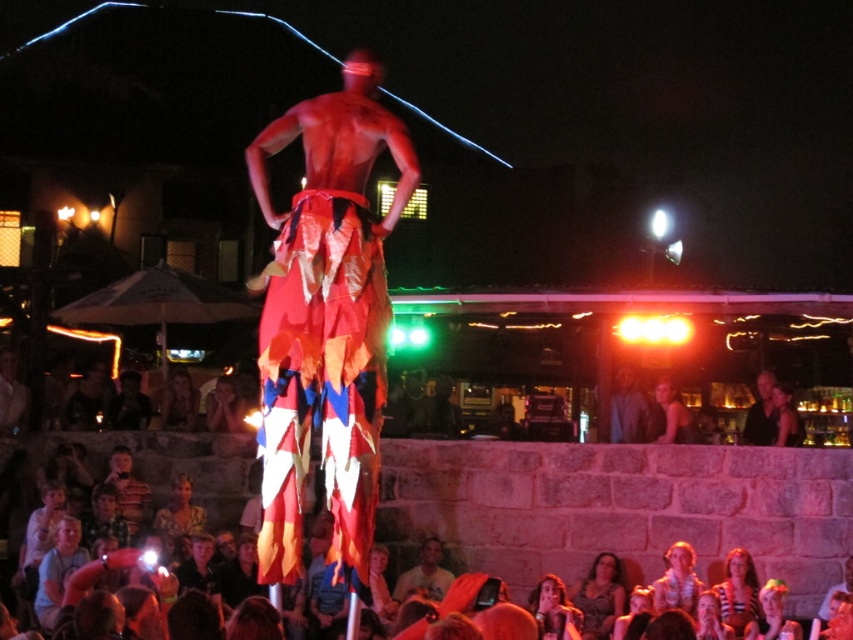
Question: Is smooth black shirt at right to the left of dark brown leather jacket at center from the viewer's perspective?

Choices:
 (A) yes
 (B) no

Answer: (B)

Question: Among these points, which one is nearest to the camera?

Choices:
 (A) (166, 392)
 (B) (755, 592)
 (C) (585, 611)
 (D) (654, 602)

Answer: (D)

Question: Among these objects, which one is nearest to the camera?

Choices:
 (A) smooth black shirt at right
 (B) patterned fabric dress at lower center
 (C) light blue cotton shirt at lower left

Answer: (C)

Question: Is patterned fabric dress at lower center in front of smooth black shirt at right?

Choices:
 (A) no
 (B) yes

Answer: (B)

Question: Is striped shirt at lower right to the left of dark brown leather jacket at center from the viewer's perspective?

Choices:
 (A) no
 (B) yes

Answer: (A)

Question: Among these points, which one is nearest to the camera?

Choices:
 (A) (44, 602)
 (B) (166, 396)

Answer: (A)